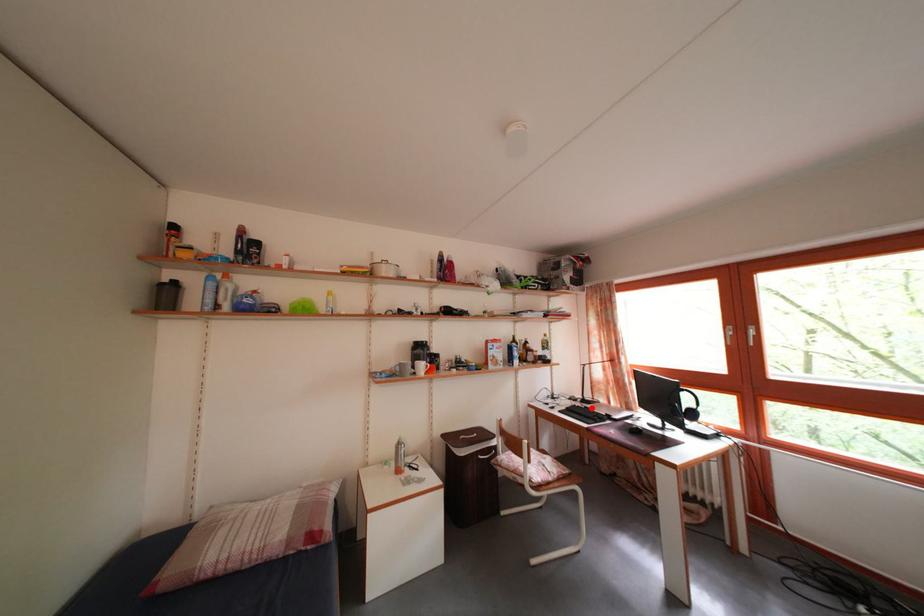
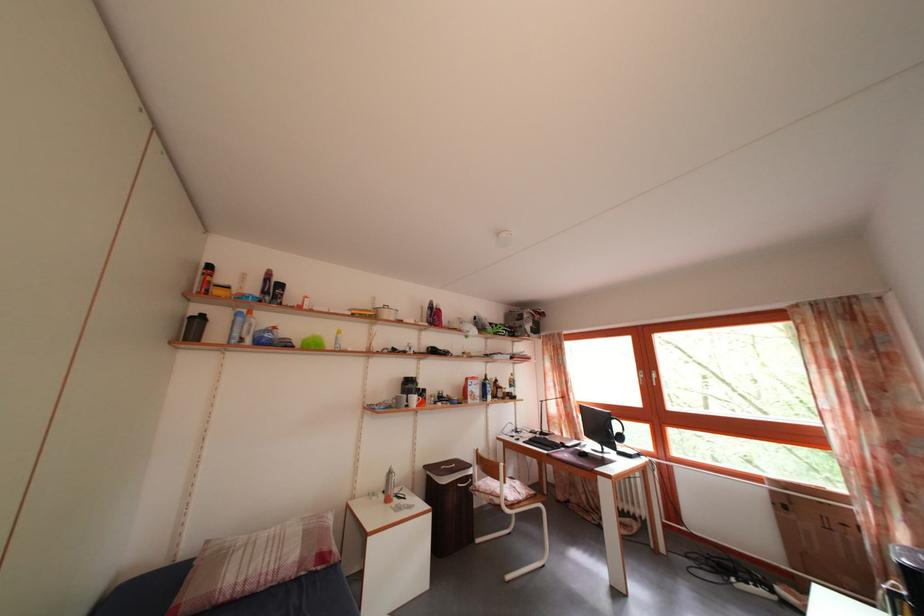
Question: I am providing you with two images of the same scene from different viewpoints. Image1 has a red point marked. In image2, the corresponding 3D location appears at what relative position? Reply with the corresponding letter.

Choices:
 (A) Closer
 (B) Farther

Answer: (B)